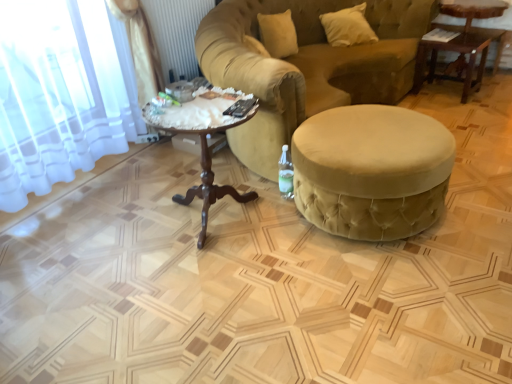
Where is `free region on the left part of clear glass bottle at lower right`? This screenshot has height=384, width=512. free region on the left part of clear glass bottle at lower right is located at coordinates (261, 200).